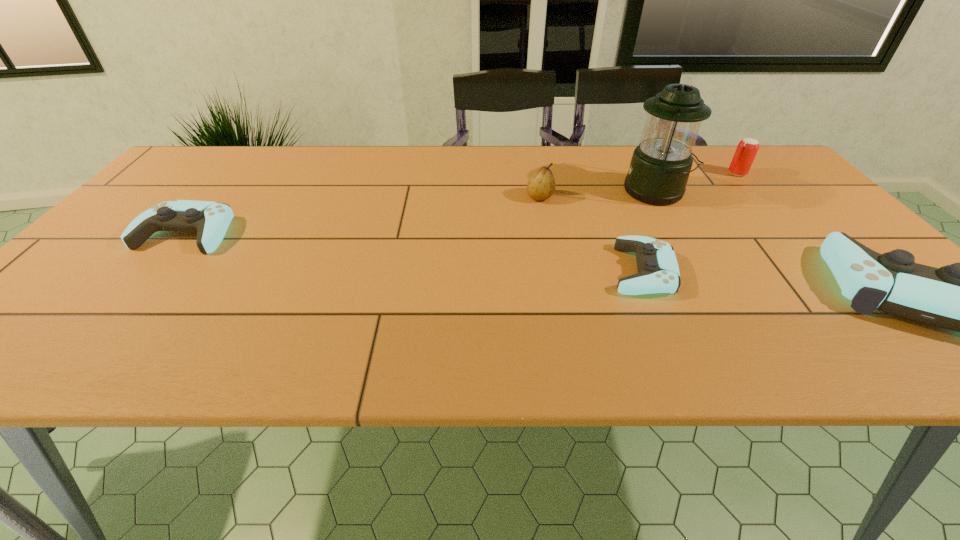
Identify which object is the fifth closest to the lantern. Please provide its 2D coordinates. Your answer should be formatted as a tuple, i.e. [(x, y)], where the tuple contains the x and y coordinates of a point satisfying the conditions above.

[(210, 220)]

Locate which control ranks in proximity to the pear. Please provide its 2D coordinates. Your answer should be formatted as a tuple, i.e. [(x, y)], where the tuple contains the x and y coordinates of a point satisfying the conditions above.

[(658, 272)]

You are a GUI agent. You are given a task and a screenshot of the screen. Output one action in this format:
    pyautogui.click(x=<x>, y=<y>)
    Task: Click on the control that stands as the closest to the fifth object from right to left
    This screenshot has height=540, width=960.
    Given the screenshot: What is the action you would take?
    pyautogui.click(x=658, y=272)